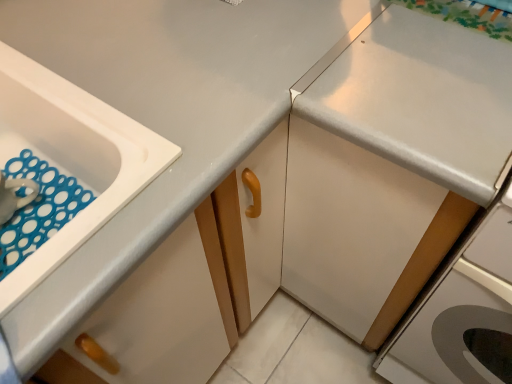
Identify the location of free spot above white glossy drawer at lower left (from a real-world perspective). This screenshot has height=384, width=512. (78, 264).